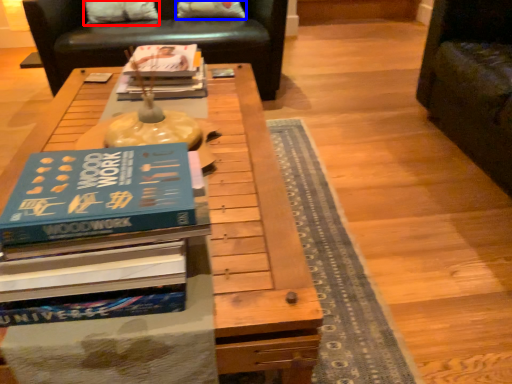
Question: Which object appears closest to the camera in this image, pillow (highlighted by a red box) or pillow (highlighted by a blue box)?

Choices:
 (A) pillow
 (B) pillow

Answer: (A)